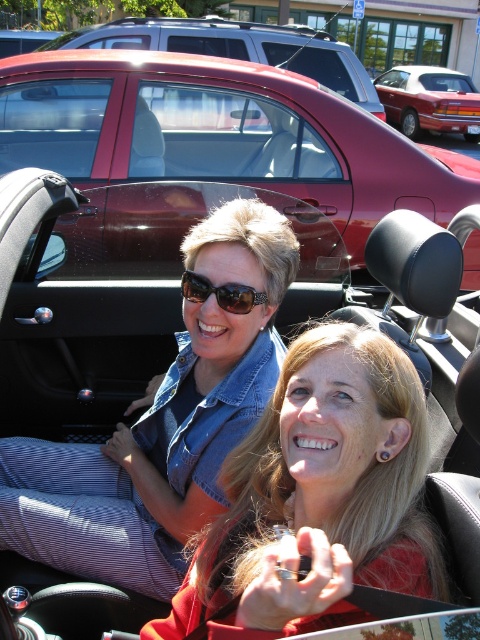
Is matte black car at center positioned at the back of shiny maroon convertible at center?

No, it is in front of shiny maroon convertible at center.

Is point (396, 385) less distant than point (367, 228)?

Yes, it is in front of point (367, 228).

At what (x,y) coordinates should I click in order to perform the action: click on matte black car at center. Please return your answer as a coordinate pair (x, y). Image resolution: width=480 pixels, height=640 pixels. Looking at the image, I should click on (317, 497).

Does matte black car at center appear on the left side of matte red sedan at center?

Yes, matte black car at center is to the left of matte red sedan at center.

How distant is matte black car at center from matte red sedan at center?

62.03 feet

Is point (216, 548) positioned behind point (443, 124)?

No, (216, 548) is closer to viewer.

You are a GUI agent. You are given a task and a screenshot of the screen. Output one action in this format:
    pyautogui.click(x=<x>, y=<y>)
    Task: Click on the matte black car at center
    This screenshot has height=640, width=480.
    Given the screenshot: What is the action you would take?
    pyautogui.click(x=317, y=497)

Looking at this image, is matte black car at center closer to the viewer compared to brown textured sunglasses at center?

Yes, it is.

Find the location of a particular element. This screenshot has width=480, height=640. matte black car at center is located at coordinates (317, 497).

Where is `matte black car at center`? matte black car at center is located at coordinates (317, 497).